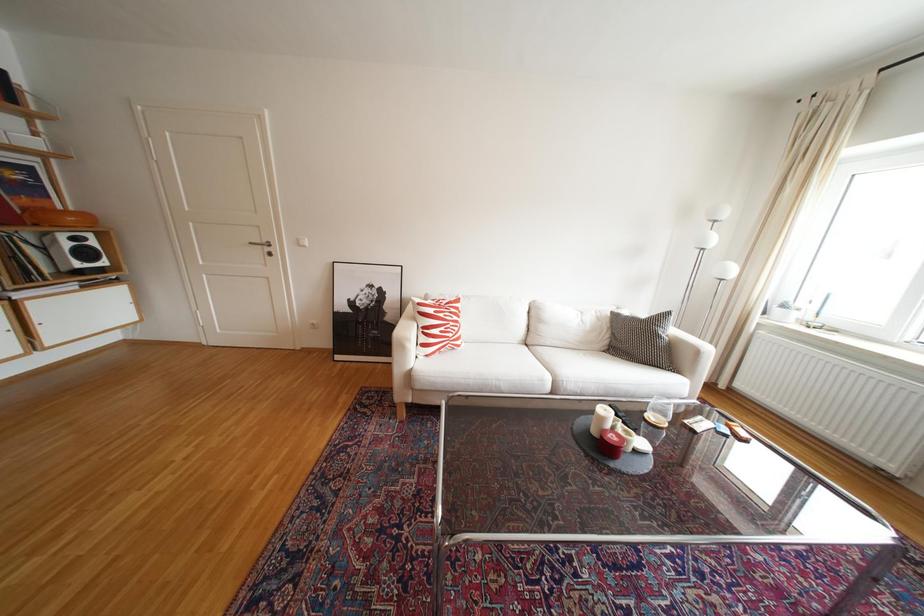
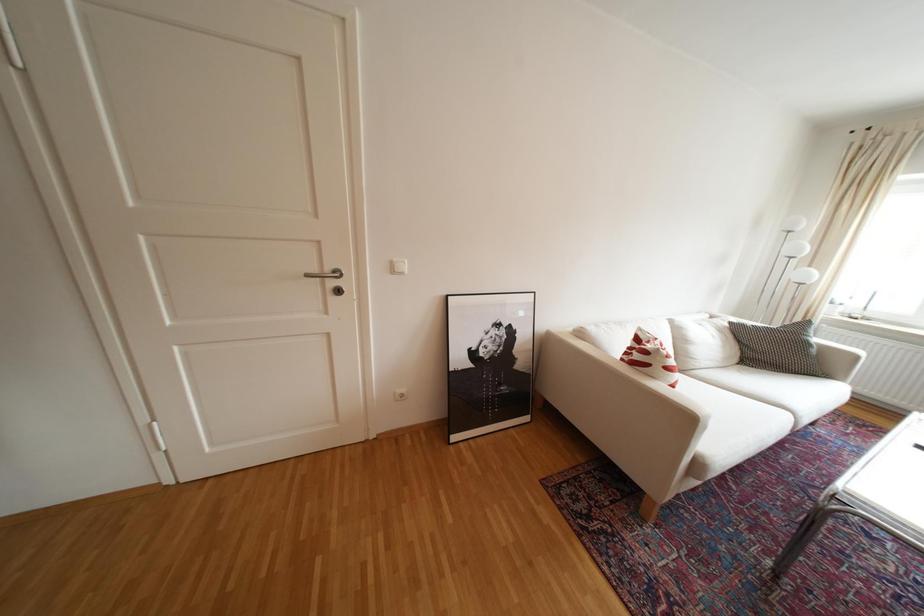
The images are taken continuously from a first-person perspective. In which direction are you moving?

The movement direction of the cameraman is left, forward.